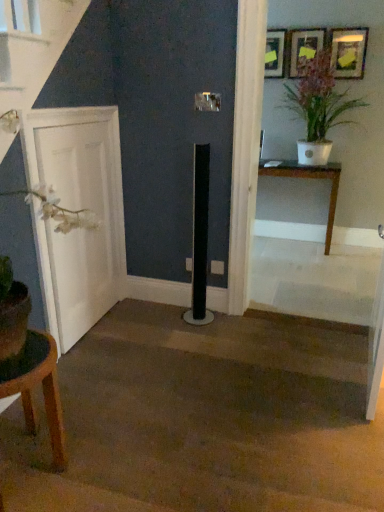
Question: From the image's perspective, is white matte door at left under wooden picture frame at upper center, acting as the 2th picture frame starting from the left?

Choices:
 (A) yes
 (B) no

Answer: (A)

Question: Does white matte door at left turn towards wooden picture frame at upper center, acting as the 2th picture frame starting from the left?

Choices:
 (A) no
 (B) yes

Answer: (A)

Question: Can we say white matte door at left lies outside wooden picture frame at upper center, acting as the 2th picture frame starting from the left?

Choices:
 (A) yes
 (B) no

Answer: (A)

Question: Does white matte door at left have a lesser width compared to wooden picture frame at upper center, acting as the 2th picture frame starting from the left?

Choices:
 (A) no
 (B) yes

Answer: (B)

Question: Can you confirm if white matte door at left is positioned to the left of wooden picture frame at upper center, acting as the 2th picture frame starting from the left?

Choices:
 (A) no
 (B) yes

Answer: (B)

Question: Is wooden picture frame at upper center, which ranks as the 2th picture frame in right-to-left order, completely or partially inside white matte door at left?

Choices:
 (A) no
 (B) yes

Answer: (A)

Question: Is wooden picture frame at upper center, which ranks as the 2th picture frame in right-to-left order, positioned with its back to brown carpet at center?

Choices:
 (A) yes
 (B) no

Answer: (B)

Question: Does wooden picture frame at upper center, acting as the 2th picture frame starting from the left, have a greater height compared to brown carpet at center?

Choices:
 (A) no
 (B) yes

Answer: (B)

Question: Can brown carpet at center be found inside wooden picture frame at upper center, which ranks as the 2th picture frame in right-to-left order?

Choices:
 (A) yes
 (B) no

Answer: (B)

Question: Is there a large distance between wooden picture frame at upper center, which ranks as the 2th picture frame in right-to-left order, and brown carpet at center?

Choices:
 (A) yes
 (B) no

Answer: (A)

Question: Is wooden picture frame at upper center, which ranks as the 2th picture frame in right-to-left order, positioned in front of brown carpet at center?

Choices:
 (A) yes
 (B) no

Answer: (B)

Question: Is wooden picture frame at upper center, acting as the 2th picture frame starting from the left, directly adjacent to brown carpet at center?

Choices:
 (A) yes
 (B) no

Answer: (B)

Question: Are wooden picture frame at upper center, which ranks as the 2th picture frame in right-to-left order, and brown wooden table at lower left, the second table positioned from the top, making contact?

Choices:
 (A) no
 (B) yes

Answer: (A)